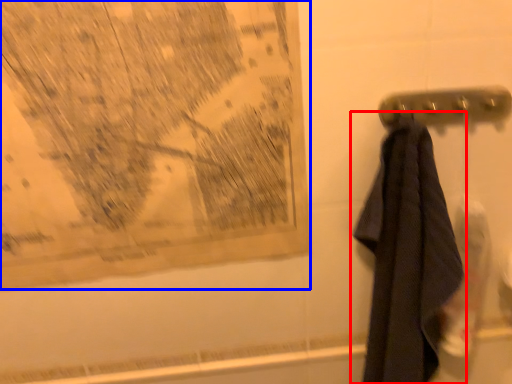
Question: Which object is closer to the camera taking this photo, towel (highlighted by a red box) or map (highlighted by a blue box)?

Choices:
 (A) towel
 (B) map

Answer: (A)